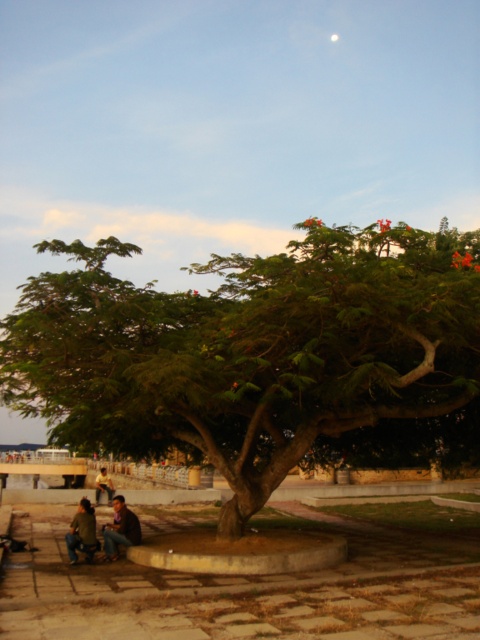
You are standing in front of the green leafy tree at center and want to take a photo with your phone. If your phone camera has a maximum focus distance of 8 meters, will it be able to capture the tree clearly?

The green leafy tree at center and camera are 8.57 meters apart from each other, which exceeds the phone camera maximum focus distance of 8 meters. Therefore, the tree will not be captured clearly.

You are standing at the center of the tree and want to walk to both the green fabric jacket at lower left and the yellow fabric shirt at lower left. Which one is closer to you?

The green fabric jacket at lower left and yellow fabric shirt at lower left are 11.84 meters apart from each other. However, since both are located at the lower left, their exact positions relative to each other aren

You are a photographer trying to capture a closeup of the yellow fabric shirt at lower left. Since the green fabric jacket at lower left is in the way, can you move it slightly to the right to get a clearer shot? Explain your reasoning based on their sizes.

The green fabric jacket at lower left occupies less space than yellow fabric shirt at lower left. Since the jacket is smaller in size, moving it slightly to the right might allow the photographer to get a clearer shot of the shirt without blocking it.